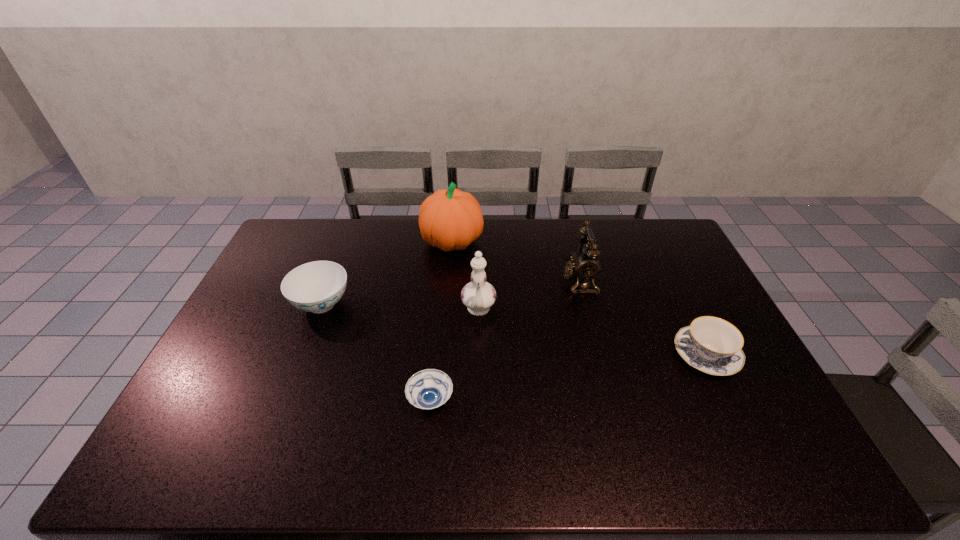
Locate an element on the screen. the farthest object is located at coordinates (451, 219).

At what (x,y) coordinates should I click in order to perform the action: click on the tallest chinaware. Please return your answer as a coordinate pair (x, y). The height and width of the screenshot is (540, 960). Looking at the image, I should click on [x=478, y=296].

This screenshot has height=540, width=960. Identify the location of telephone. (585, 265).

At what (x,y) coordinates should I click in order to perform the action: click on the leftmost object. Please return your answer as a coordinate pair (x, y). This screenshot has height=540, width=960. Looking at the image, I should click on tap(316, 287).

You are a GUI agent. You are given a task and a screenshot of the screen. Output one action in this format:
    pyautogui.click(x=<x>, y=<y>)
    Task: Click on the rightmost chinaware
    Image resolution: width=960 pixels, height=540 pixels.
    Given the screenshot: What is the action you would take?
    pyautogui.click(x=712, y=345)

Where is `the nearest chinaware`? the nearest chinaware is located at coordinates (712, 345).

This screenshot has width=960, height=540. I want to click on soup bowl, so click(x=428, y=389).

Locate an element on the screen. The height and width of the screenshot is (540, 960). vacant position located 0.090m on the front of the farthest object is located at coordinates (449, 278).

Locate an element on the screen. vacant space positioned 0.060m at the spout of the tallest chinaware is located at coordinates (478, 343).

At what (x,y) coordinates should I click in order to perform the action: click on vacant point located 0.140m on the rotary dial of the second object from right to left. Please return your answer as a coordinate pair (x, y). Looking at the image, I should click on (521, 281).